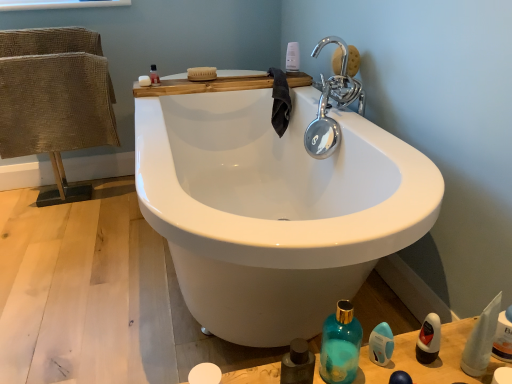
Where is `free region under burlap fabric chair at left (from a real-world perspective)`? This screenshot has width=512, height=384. free region under burlap fabric chair at left (from a real-world perspective) is located at coordinates (80, 188).